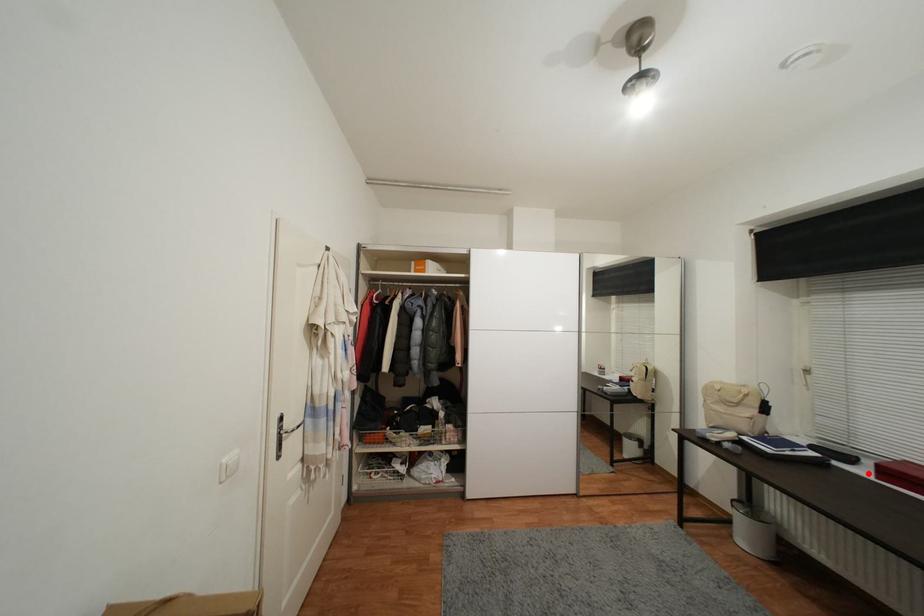
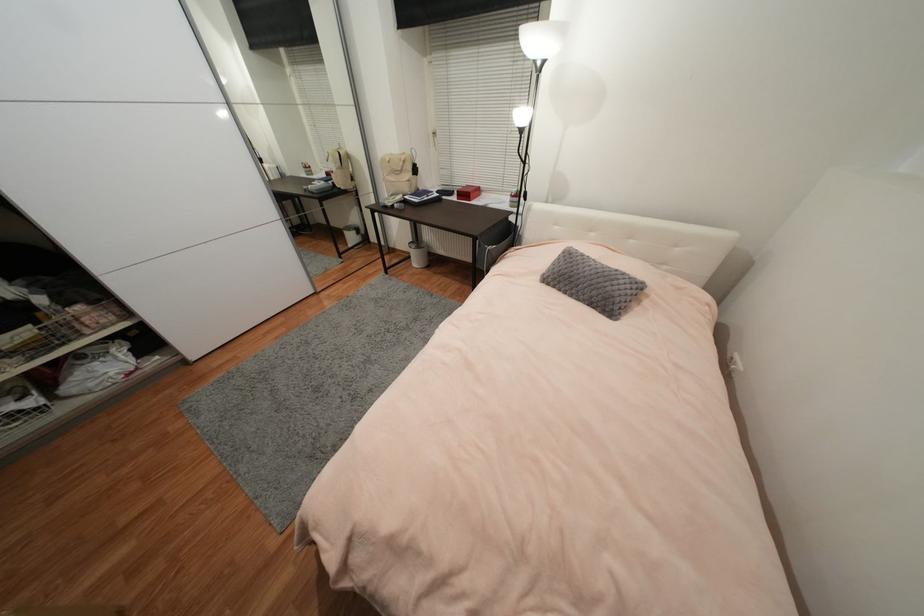
Question: I am providing you with two images of the same scene from different viewpoints. Image1 has a red point marked. In image2, the corresponding 3D location appears at what relative position? Reply with the corresponding letter.

Choices:
 (A) Closer
 (B) Farther

Answer: (A)